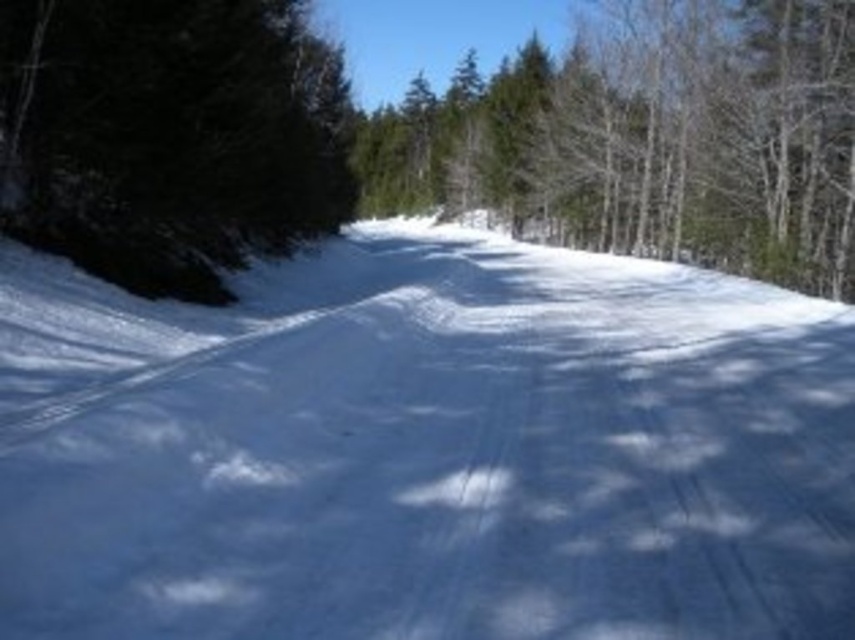
Is green matte tree at center smaller than dark green evergreen at left?

No, green matte tree at center is not smaller than dark green evergreen at left.

Who is positioned more to the left, green matte tree at center or dark green evergreen at left?

dark green evergreen at left is more to the left.

The width and height of the screenshot is (855, 640). What do you see at coordinates (647, 140) in the screenshot?
I see `green matte tree at center` at bounding box center [647, 140].

Where is `green matte tree at center`? This screenshot has width=855, height=640. green matte tree at center is located at coordinates (647, 140).

What do you see at coordinates (425, 449) in the screenshot? This screenshot has height=640, width=855. I see `white snow at center` at bounding box center [425, 449].

Is point (275, 284) positioned behind point (687, 88)?

No, it is in front of (687, 88).

Locate an element on the screen. white snow at center is located at coordinates (425, 449).

Is white snow at center below dark green evergreen at left?

Yes.

At what (x,y) coordinates should I click in order to perform the action: click on white snow at center. Please return your answer as a coordinate pair (x, y). The image size is (855, 640). Looking at the image, I should click on (425, 449).